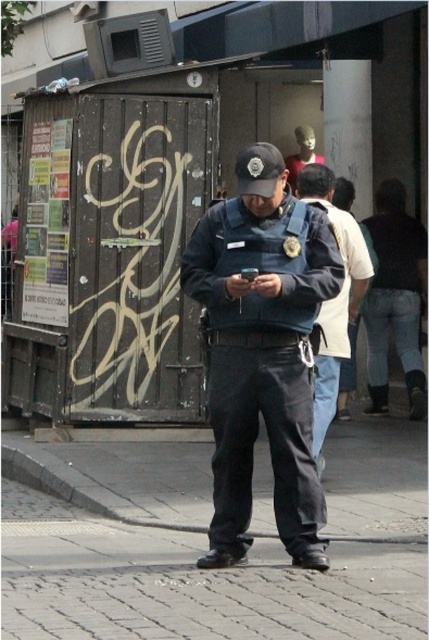
Question: Is denim jeans at right positioned at the back of smooth plastic head at center?

Choices:
 (A) yes
 (B) no

Answer: (B)

Question: Can you confirm if denim jeans at right is wider than light blue denim jeans at center?

Choices:
 (A) no
 (B) yes

Answer: (B)

Question: Which of the following is the farthest from the observer?

Choices:
 (A) (305, 272)
 (B) (326, 356)

Answer: (B)

Question: Is gray cobblestone pavement at center positioned before light blue denim jeans at center?

Choices:
 (A) yes
 (B) no

Answer: (A)

Question: Among these points, which one is nearest to the camera?

Choices:
 (A) (296, 184)
 (B) (344, 298)
 (C) (238, 394)

Answer: (C)

Question: Which point is closer to the camera taking this photo?

Choices:
 (A) (326, 419)
 (B) (402, 221)
 (C) (66, 586)

Answer: (C)